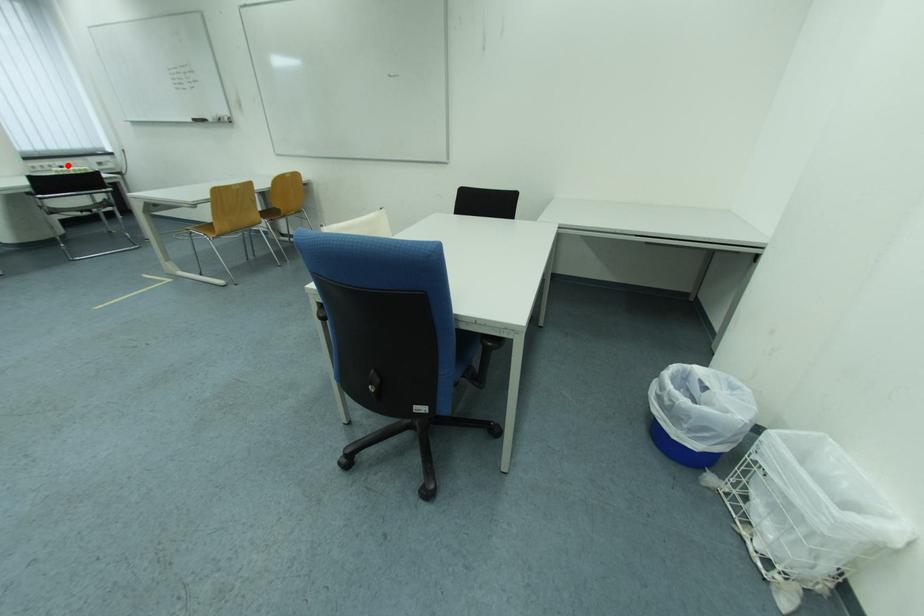
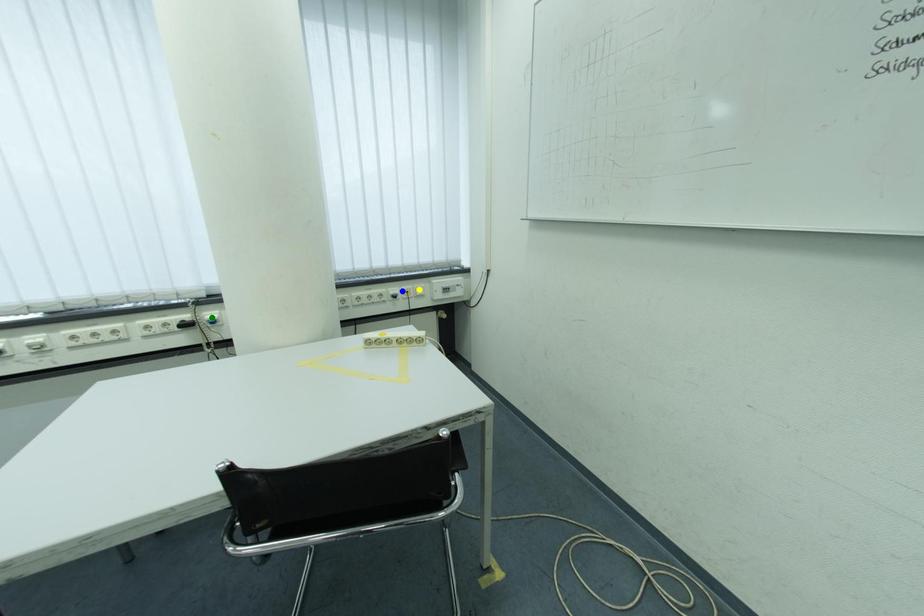
Question: I am providing you with two images of the same scene from different viewpoints. A red point is marked on the first image. You are given multiple points on the second image. Which spot in image 2 lines up with the point in image 1?

Choices:
 (A) green point
 (B) blue point
 (C) yellow point

Answer: (B)